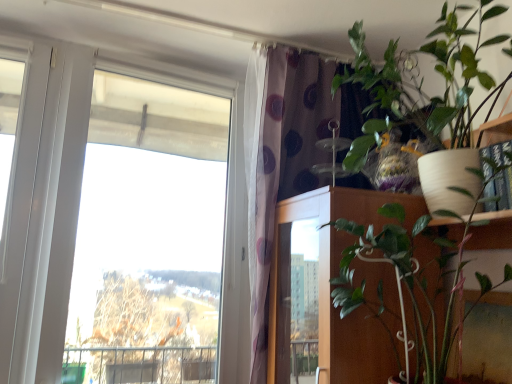
Question: From the image's perspective, is purple dotted curtain at upper center located above or below transparent glass window at left?

Choices:
 (A) above
 (B) below

Answer: (B)

Question: From a real-world perspective, is purple dotted curtain at upper center positioned above or below transparent glass window at left?

Choices:
 (A) above
 (B) below

Answer: (A)

Question: Which is farther from the transparent glass window at left?

Choices:
 (A) wooden door at center
 (B) purple dotted curtain at upper center
 (C) white matte pot at upper right

Answer: (C)

Question: Considering the real-world distances, which object is farthest from the white matte pot at upper right?

Choices:
 (A) transparent glass window at left
 (B) purple dotted curtain at upper center
 (C) wooden door at center

Answer: (A)